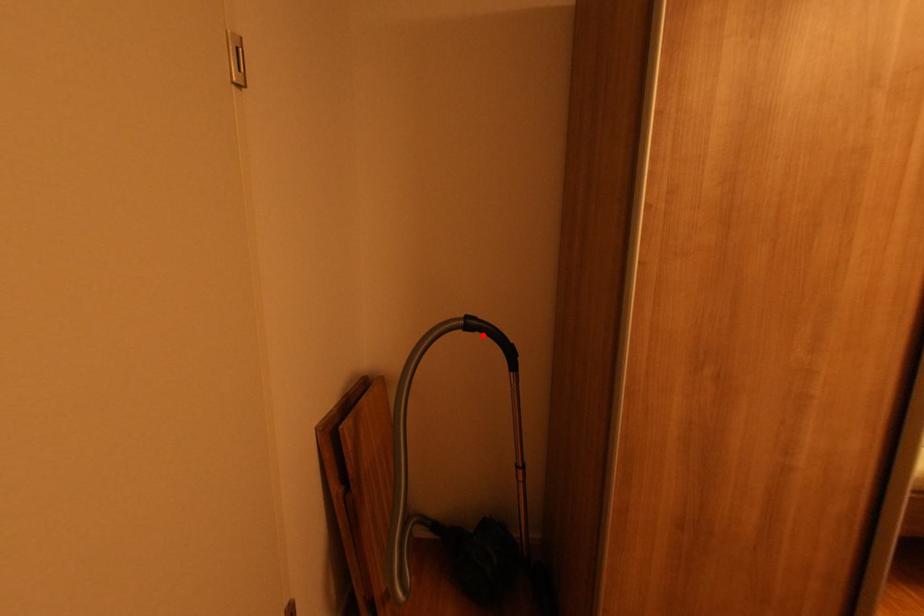
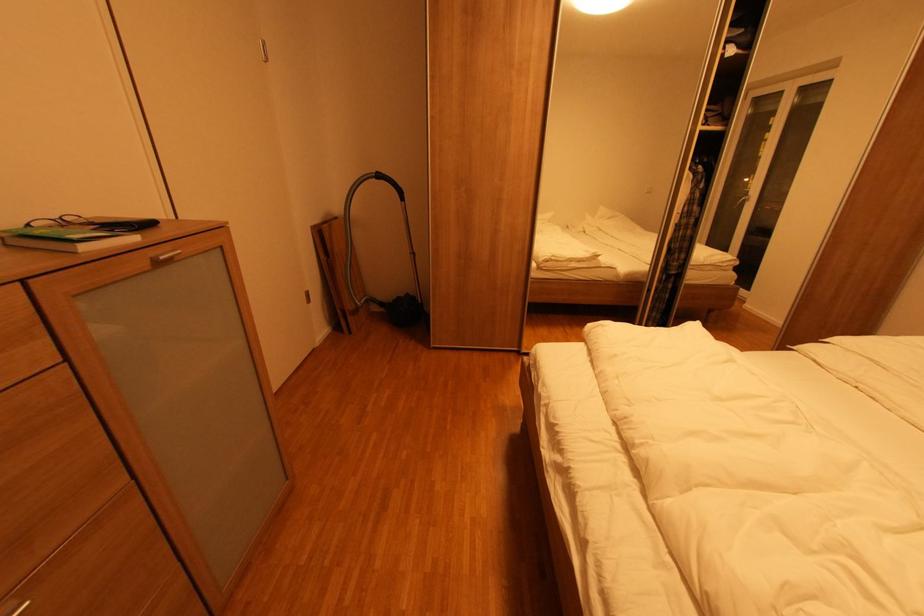
Question: I am providing you with two images of the same scene from different viewpoints. A red point is shown in image1. For the corresponding object point in image2, is it positioned nearer or farther from the camera?

Choices:
 (A) Nearer
 (B) Farther

Answer: (A)